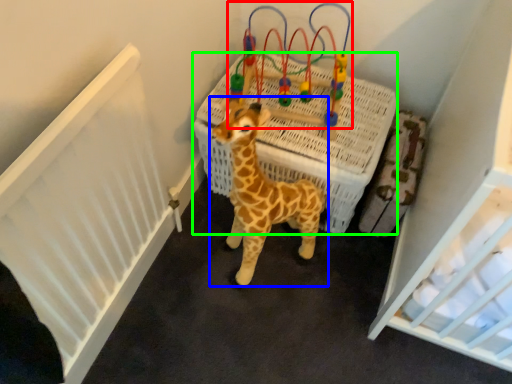
Question: Based on their relative distances, which object is nearer to toy (highlighted by a red box)? Choose from giraffe (highlighted by a blue box) and infant bed (highlighted by a green box).

Choices:
 (A) giraffe
 (B) infant bed

Answer: (B)